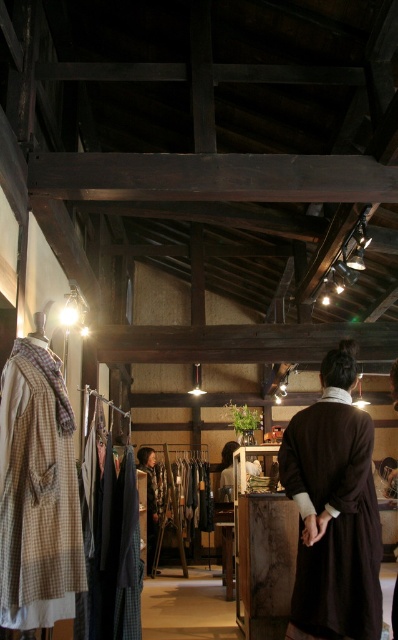
You are standing in the rustic shop and want to move from the point at coordinates point (325, 552) to the point at coordinates point (224, 483). Which direction should you move to reach your destination?

You should move backward because point (325, 552) is in front of point (224, 483), so moving backward will take you towards the latter.